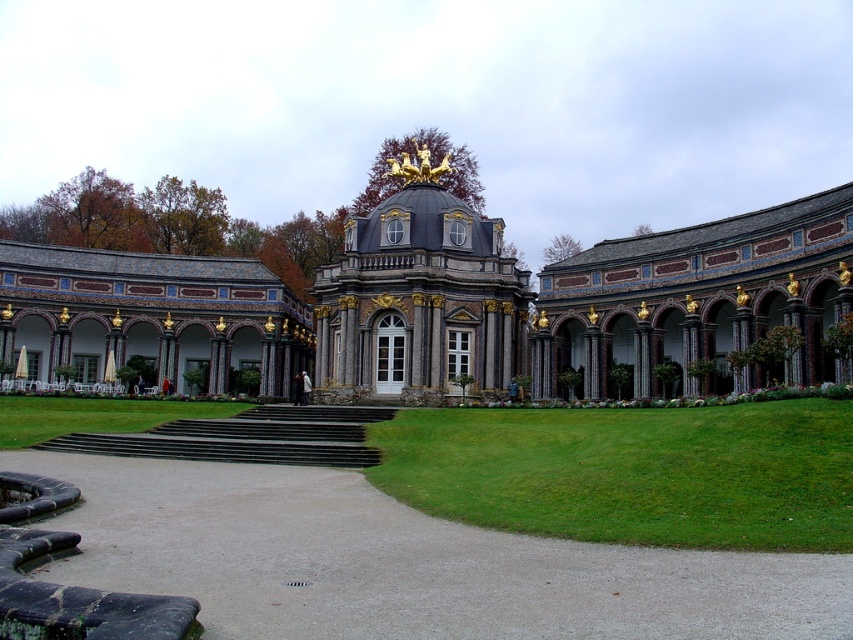
Based on the coordinates provided, what is the primary structure located at point (454,305) in the image?

The point (454,305) indicates the polished stone palace at center.

You are standing at the entrance of the polished stone palace at center and want to reach the green grass at lower right. Which direction should you walk to get there?

The polished stone palace at center is positioned over green grass at lower right, so you should walk downward from the palace to reach the green grass at lower right.

You are standing in the palace garden and want to take a photo of the polished stone palace at center and the matte stone patio at lower left. Which object will appear larger in your photo?

The polished stone palace at center will appear larger in the photo because it is closer to the viewer than the matte stone patio at lower left.